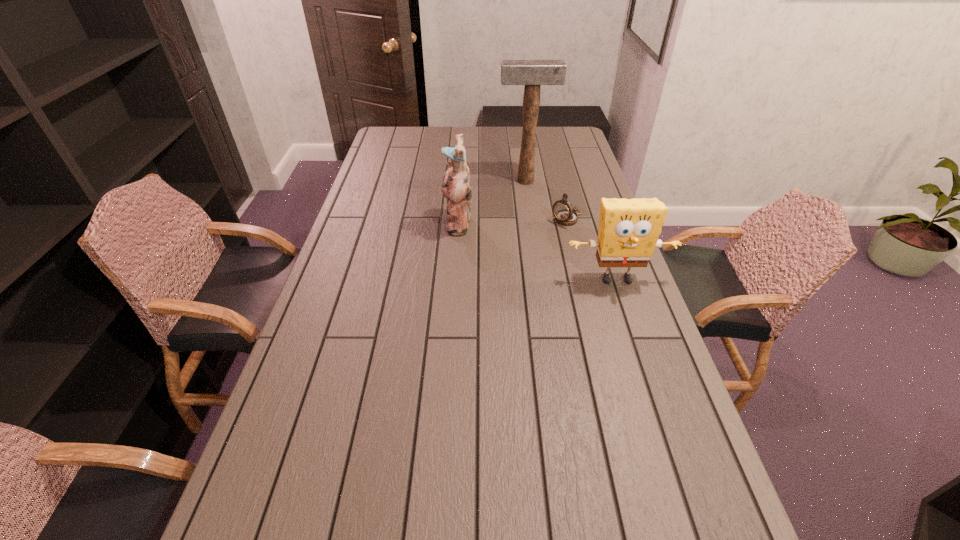
Identify the location of blank space at the near edge of the desktop. (507, 482).

Where is `vacant space at the left edge of the desktop`? vacant space at the left edge of the desktop is located at coordinates (350, 303).

Locate an element on the screen. The image size is (960, 540). free space at the right edge of the desktop is located at coordinates (550, 150).

This screenshot has width=960, height=540. I want to click on vacant area at the far left corner, so click(x=381, y=138).

Locate an element on the screen. free spot between the figurine and the farthest object is located at coordinates (492, 202).

Identify the location of vacant area that lies between the compass and the figurine. (513, 221).

Find the location of a particular element. vacant space in between the compass and the leftmost object is located at coordinates (x=513, y=221).

Where is `free spot between the shortest object and the nearest object`? This screenshot has width=960, height=540. free spot between the shortest object and the nearest object is located at coordinates (591, 249).

Where is `empty space between the compass and the mallet`? This screenshot has height=540, width=960. empty space between the compass and the mallet is located at coordinates 546,200.

Locate an element on the screen. Image resolution: width=960 pixels, height=540 pixels. empty space between the third shortest object and the farthest object is located at coordinates (492, 202).